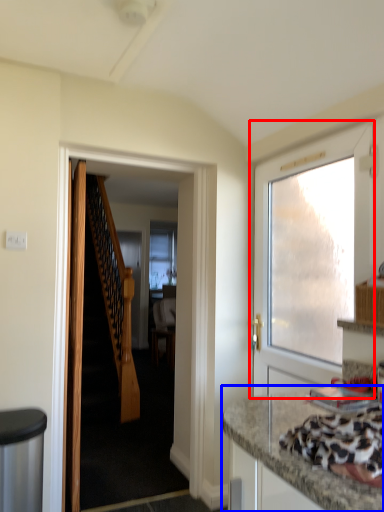
Question: Which object is further to the camera taking this photo, door (highlighted by a red box) or countertop (highlighted by a blue box)?

Choices:
 (A) door
 (B) countertop

Answer: (A)